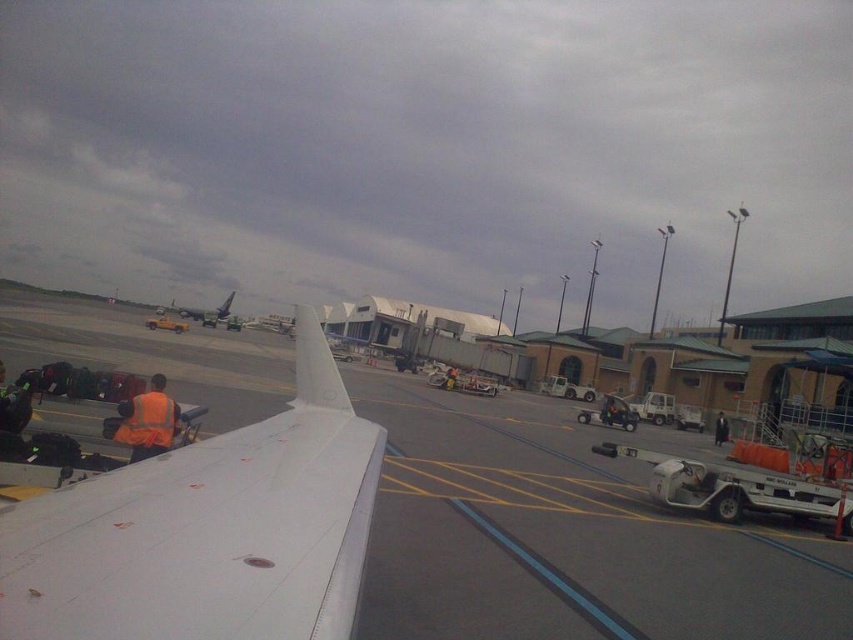
Question: Which object is the farthest from the metallic gray airplane at center?

Choices:
 (A) orange reflective vest at center
 (B) white matte wing at lower left
 (C) orange reflective vest at lower left

Answer: (C)

Question: Can you confirm if white matte wing at lower left is smaller than yellow matte truck at center?

Choices:
 (A) no
 (B) yes

Answer: (B)

Question: Can you confirm if white matte wing at lower left is thinner than metallic gray airplane at center?

Choices:
 (A) no
 (B) yes

Answer: (B)

Question: Can you confirm if white matte wing at lower left is thinner than yellow matte truck at center?

Choices:
 (A) yes
 (B) no

Answer: (A)

Question: Which of these objects is positioned farthest from the metallic gray airplane at center?

Choices:
 (A) white matte wing at lower left
 (B) white matte tarmac at center

Answer: (A)

Question: Among these objects, which one is nearest to the camera?

Choices:
 (A) orange reflective vest at lower left
 (B) white matte tarmac at center
 (C) white matte wing at lower left

Answer: (B)